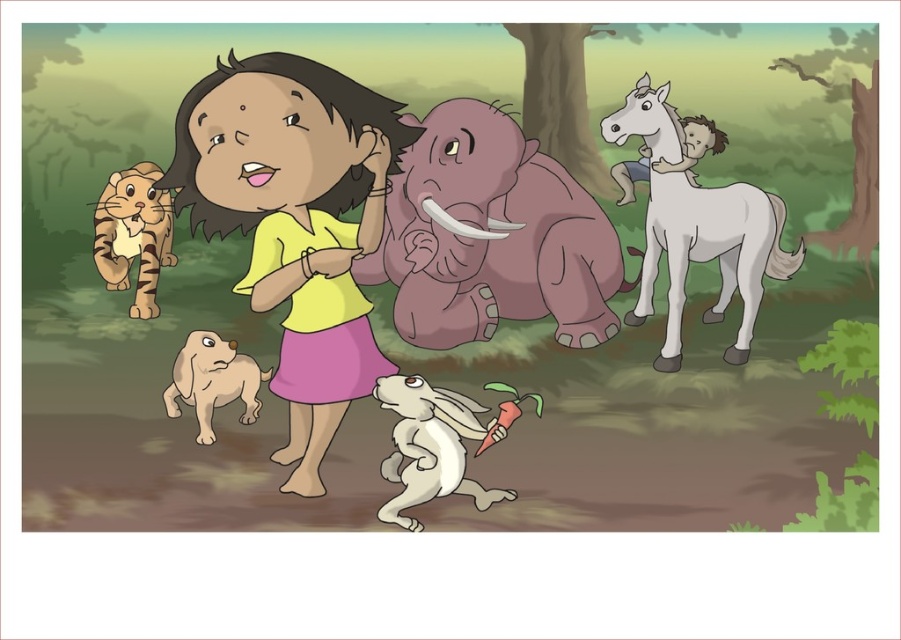
Question: Which point is closer to the camera?

Choices:
 (A) striped fur tiger at left
 (B) fuzzy beige dog at lower left

Answer: (B)

Question: Is white glossy horse at upper right smaller than fuzzy beige dog at lower left?

Choices:
 (A) yes
 (B) no

Answer: (B)

Question: Which object appears closest to the camera in this image?

Choices:
 (A) fuzzy beige dog at lower left
 (B) white glossy horse at upper right

Answer: (A)

Question: Can you confirm if yellow matte shirt at center is smaller than striped fur tiger at left?

Choices:
 (A) no
 (B) yes

Answer: (A)

Question: Which object appears closest to the camera in this image?

Choices:
 (A) white glossy horse at upper right
 (B) striped fur tiger at left
 (C) purple matte elephant at center
 (D) yellow matte shirt at center

Answer: (D)

Question: Does purple matte elephant at center appear on the left side of white glossy horse at upper right?

Choices:
 (A) yes
 (B) no

Answer: (A)